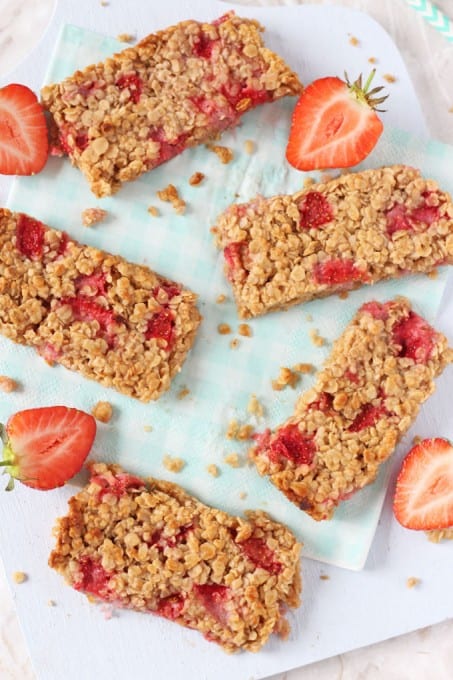
In order to click on white wooden board underneath dish towel in this screenshot , I will do `click(36, 526)`, `click(63, 638)`, `click(161, 657)`, `click(327, 630)`, `click(405, 545)`, `click(442, 579)`, `click(439, 408)`, `click(322, 37)`, `click(115, 15)`.